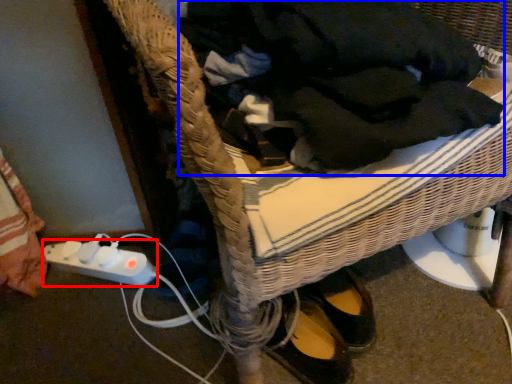
Question: Among these objects, which one is farthest to the camera, plug (highlighted by a red box) or clothing (highlighted by a blue box)?

Choices:
 (A) plug
 (B) clothing

Answer: (A)